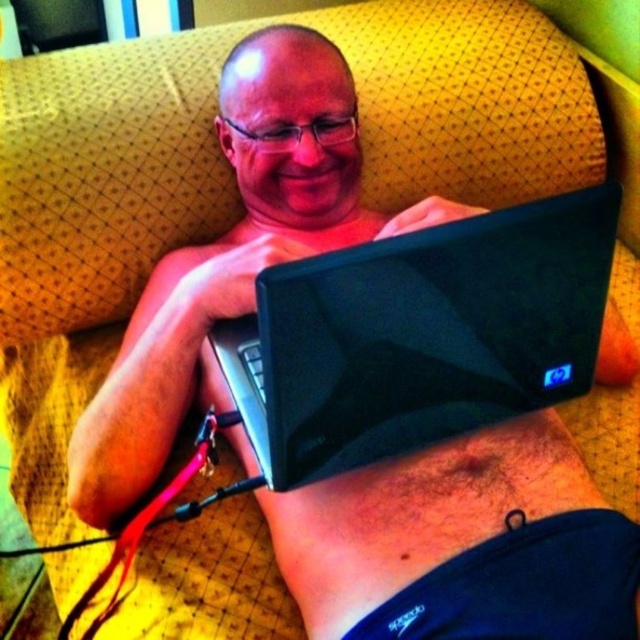
Can you confirm if black glossy laptop at center is smaller than hairy skin at center?

Actually, black glossy laptop at center might be larger than hairy skin at center.

Is black glossy laptop at center to the right of hairy skin at center from the viewer's perspective?

Incorrect, black glossy laptop at center is not on the right side of hairy skin at center.

Is point (294, 388) more distant than point (400, 573)?

No, (294, 388) is in front of (400, 573).

Image resolution: width=640 pixels, height=640 pixels. I want to click on black glossy laptop at center, so click(x=420, y=336).